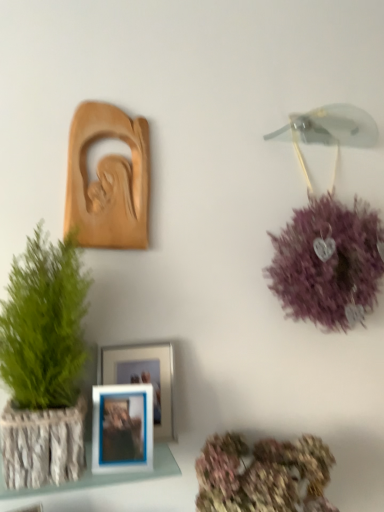
Question: Does blue plastic picture frame at center, acting as the 2th picture frame starting from the top, have a greater height compared to pastel floral bouquet at lower center?

Choices:
 (A) no
 (B) yes

Answer: (B)

Question: Is blue plastic picture frame at center, which is counted as the second picture frame, starting from the bottom, with pastel floral bouquet at lower center?

Choices:
 (A) no
 (B) yes

Answer: (A)

Question: Could you tell me if blue plastic picture frame at center, which is counted as the second picture frame, starting from the bottom, is facing pastel floral bouquet at lower center?

Choices:
 (A) yes
 (B) no

Answer: (B)

Question: Does blue plastic picture frame at center, which is counted as the second picture frame, starting from the bottom, have a greater width compared to pastel floral bouquet at lower center?

Choices:
 (A) yes
 (B) no

Answer: (B)

Question: Does blue plastic picture frame at center, acting as the 2th picture frame starting from the top, come in front of pastel floral bouquet at lower center?

Choices:
 (A) yes
 (B) no

Answer: (B)

Question: Considering the relative positions of blue plastic picture frame at center, which is counted as the second picture frame, starting from the bottom, and pastel floral bouquet at lower center in the image provided, is blue plastic picture frame at center, which is counted as the second picture frame, starting from the bottom, to the left of pastel floral bouquet at lower center from the viewer's perspective?

Choices:
 (A) yes
 (B) no

Answer: (A)

Question: Is white textured frame at lower left not near pastel floral bouquet at lower center?

Choices:
 (A) yes
 (B) no

Answer: (B)

Question: Is the position of white textured frame at lower left less distant than that of pastel floral bouquet at lower center?

Choices:
 (A) yes
 (B) no

Answer: (B)

Question: Is pastel floral bouquet at lower center a part of white textured frame at lower left?

Choices:
 (A) yes
 (B) no

Answer: (B)

Question: Does white textured frame at lower left have a lesser width compared to pastel floral bouquet at lower center?

Choices:
 (A) no
 (B) yes

Answer: (B)

Question: Does white textured frame at lower left come behind pastel floral bouquet at lower center?

Choices:
 (A) yes
 (B) no

Answer: (A)

Question: From a real-world perspective, is white textured frame at lower left located beneath pastel floral bouquet at lower center?

Choices:
 (A) no
 (B) yes

Answer: (A)

Question: Does pastel floral bouquet at lower center have a larger size compared to white textured frame at lower left?

Choices:
 (A) yes
 (B) no

Answer: (A)